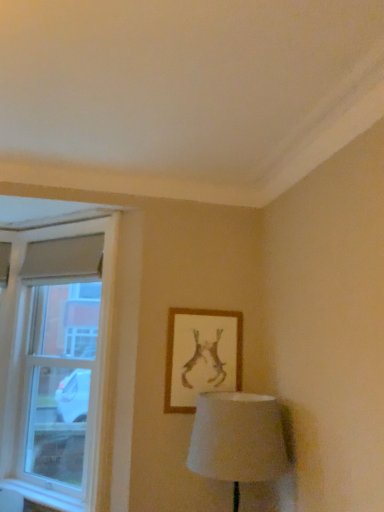
Question: Considering the relative sizes of white glass window at left and wooden framed artwork at upper center in the image provided, is white glass window at left wider than wooden framed artwork at upper center?

Choices:
 (A) no
 (B) yes

Answer: (B)

Question: Would you consider white glass window at left to be distant from wooden framed artwork at upper center?

Choices:
 (A) yes
 (B) no

Answer: (B)

Question: Does white glass window at left lie in front of wooden framed artwork at upper center?

Choices:
 (A) yes
 (B) no

Answer: (A)

Question: Does white glass window at left appear on the right side of wooden framed artwork at upper center?

Choices:
 (A) no
 (B) yes

Answer: (A)

Question: Is white glass window at left to the left of wooden framed artwork at upper center from the viewer's perspective?

Choices:
 (A) no
 (B) yes

Answer: (B)

Question: In terms of width, does white plastic window sill at lower left look wider or thinner when compared to wooden framed artwork at upper center?

Choices:
 (A) thin
 (B) wide

Answer: (B)

Question: Considering the positions of point pyautogui.click(x=34, y=492) and point pyautogui.click(x=211, y=384), is point pyautogui.click(x=34, y=492) closer or farther from the camera than point pyautogui.click(x=211, y=384)?

Choices:
 (A) closer
 (B) farther

Answer: (B)

Question: Relative to wooden framed artwork at upper center, is white plastic window sill at lower left in front or behind?

Choices:
 (A) front
 (B) behind

Answer: (A)

Question: In terms of height, does white plastic window sill at lower left look taller or shorter compared to wooden framed artwork at upper center?

Choices:
 (A) tall
 (B) short

Answer: (B)

Question: From the image's perspective, is white plastic window sill at lower left positioned above or below white glass window at left?

Choices:
 (A) below
 (B) above

Answer: (A)

Question: Is white plastic window sill at lower left to the left or to the right of white glass window at left in the image?

Choices:
 (A) left
 (B) right

Answer: (A)

Question: Is white plastic window sill at lower left in front of or behind white glass window at left in the image?

Choices:
 (A) front
 (B) behind

Answer: (A)

Question: From a real-world perspective, is white plastic window sill at lower left above or below white glass window at left?

Choices:
 (A) below
 (B) above

Answer: (A)

Question: In the image, is white glass window at left positioned in front of or behind wooden framed artwork at upper center?

Choices:
 (A) front
 (B) behind

Answer: (A)

Question: Considering the positions of white glass window at left and wooden framed artwork at upper center in the image, is white glass window at left wider or thinner than wooden framed artwork at upper center?

Choices:
 (A) thin
 (B) wide

Answer: (B)